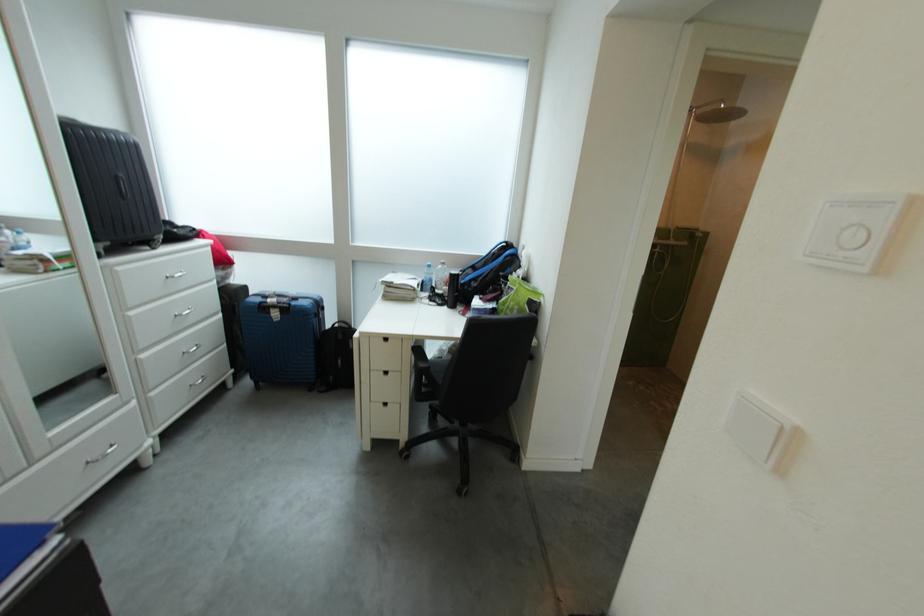
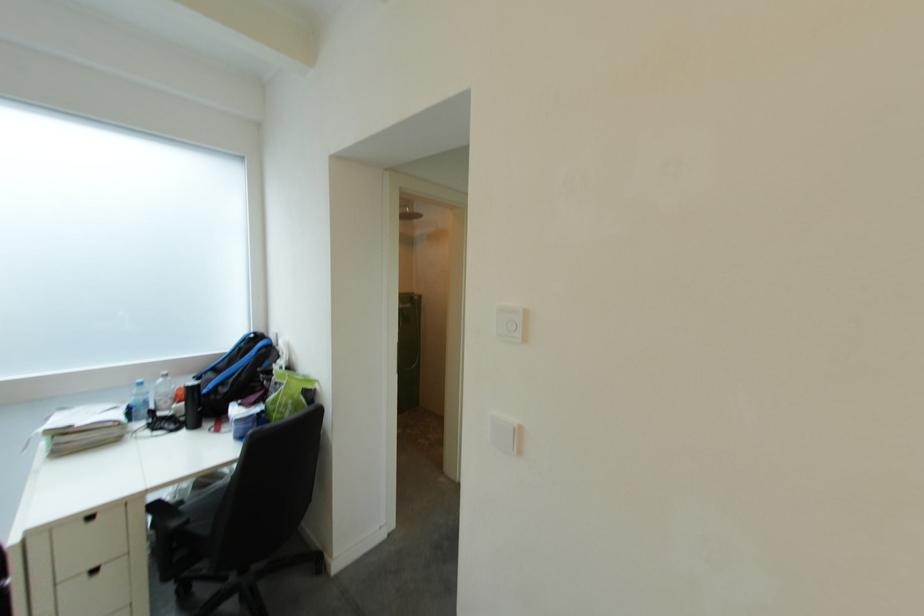
Find the pixel in the second image that matches point (434, 285) in the first image.

(141, 411)